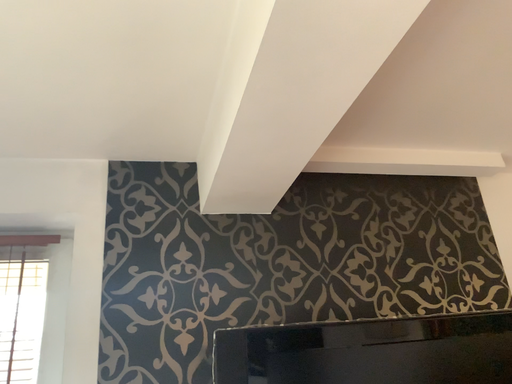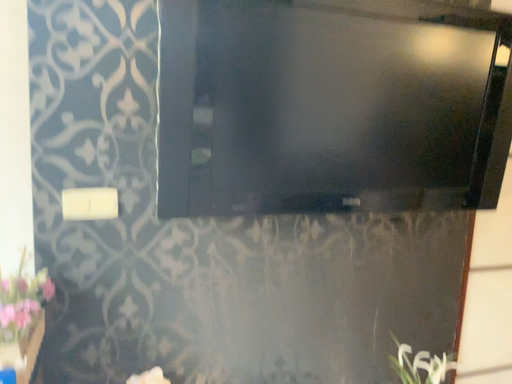
Question: Which way did the camera rotate in the video?

Choices:
 (A) rotated upward
 (B) rotated downward

Answer: (B)